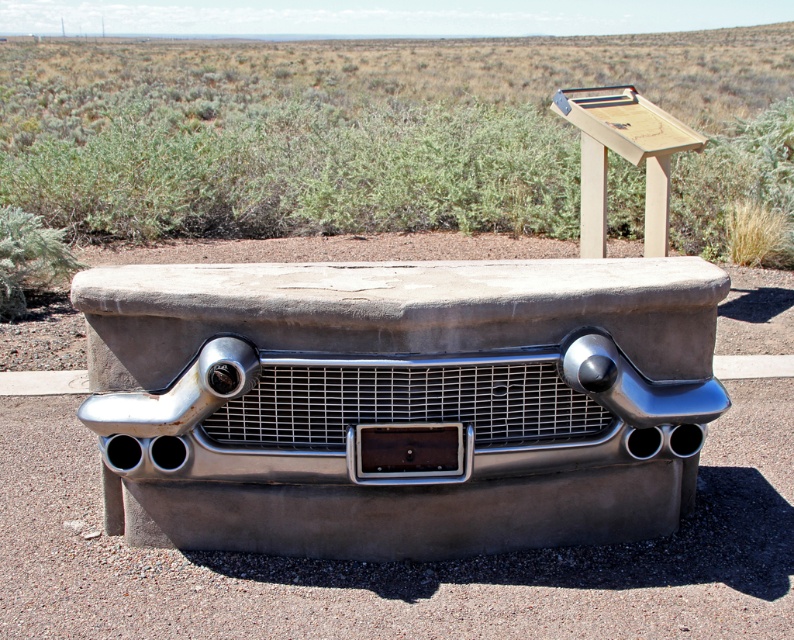
Question: Observing the image, what is the correct spatial positioning of polished chrome car at center in reference to smooth concrete bumper at center?

Choices:
 (A) left
 (B) right

Answer: (A)

Question: Among these points, which one is nearest to the camera?

Choices:
 (A) (125, 634)
 (B) (685, 404)

Answer: (A)

Question: Is polished chrome car at center below smooth concrete bumper at center?

Choices:
 (A) no
 (B) yes

Answer: (A)

Question: Can you confirm if polished chrome car at center is positioned to the left of smooth concrete bumper at center?

Choices:
 (A) yes
 (B) no

Answer: (A)